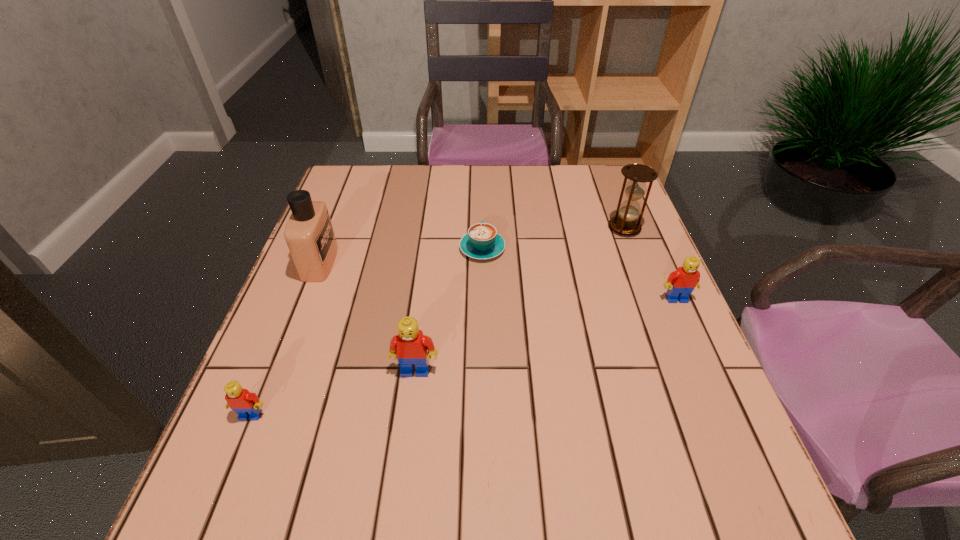
Find the location of `vacant space that is in between the fifth tallest object and the shortest object`. vacant space that is in between the fifth tallest object and the shortest object is located at coordinates (367, 332).

Identify the location of unoccupied area between the farthest Lego and the hourglass. The height and width of the screenshot is (540, 960). (650, 264).

At what (x,y) coordinates should I click in order to perform the action: click on unoccupied position between the hourglass and the shortest Lego. Please return your answer as a coordinate pair (x, y). Image resolution: width=960 pixels, height=540 pixels. Looking at the image, I should click on (438, 321).

The width and height of the screenshot is (960, 540). Find the location of `vacant area that lies between the second shortest Lego and the fourth object from right to left`. vacant area that lies between the second shortest Lego and the fourth object from right to left is located at coordinates coord(546,334).

Locate an element on the screen. The height and width of the screenshot is (540, 960). unoccupied area between the tallest Lego and the hourglass is located at coordinates (519, 299).

At what (x,y) coordinates should I click in order to perform the action: click on the closest object to the nearest object. Please return your answer as a coordinate pair (x, y). The height and width of the screenshot is (540, 960). Looking at the image, I should click on 410,346.

Locate an element on the screen. the third closest object relative to the hourglass is located at coordinates (410, 346).

Locate which Lego ranks in proximity to the fourth farthest object. Please provide its 2D coordinates. Your answer should be formatted as a tuple, i.e. [(x, y)], where the tuple contains the x and y coordinates of a point satisfying the conditions above.

[(410, 346)]

Select which Lego appears as the third closest to the perfume. Please provide its 2D coordinates. Your answer should be formatted as a tuple, i.e. [(x, y)], where the tuple contains the x and y coordinates of a point satisfying the conditions above.

[(681, 283)]

Identify the location of blank space that satisfies the following two spatial constraints: 1. with the handle on the right side of the hourglass; 2. on the right side of the shortest object. (482, 228).